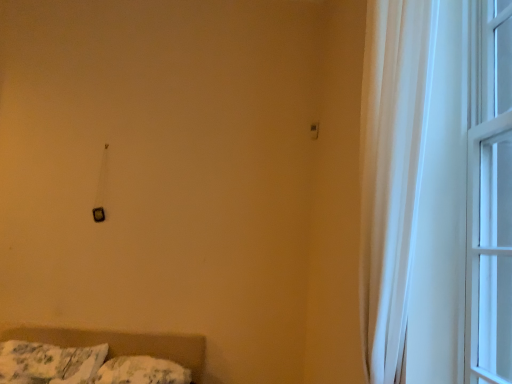
Identify the location of fluffy white pillow at lower left, placed as the first pillow when sorted from left to right. This screenshot has height=384, width=512. (49, 363).

This screenshot has height=384, width=512. What do you see at coordinates (142, 371) in the screenshot? I see `fluffy white pillow at lower left, placed as the first pillow when sorted from right to left` at bounding box center [142, 371].

Identify the location of fluffy white pillow at lower left, the 2th pillow from the left. (142, 371).

What do you see at coordinates (437, 192) in the screenshot?
I see `white sheer curtain at right, acting as the second window starting from the right` at bounding box center [437, 192].

The width and height of the screenshot is (512, 384). What are the coordinates of `fluffy white pillow at lower left, placed as the first pillow when sorted from left to right` in the screenshot? It's located at (49, 363).

Is matte black switch at upper center not inside white sheer curtain at right, which ranks as the first window in left-to-right order?

matte black switch at upper center is positioned outside white sheer curtain at right, which ranks as the first window in left-to-right order.

What's the angular difference between matte black switch at upper center and white sheer curtain at right, which ranks as the first window in left-to-right order,'s facing directions?

They differ by 89.5 degrees in their facing directions.

Which of these two, matte black switch at upper center or white sheer curtain at right, acting as the second window starting from the right, is bigger?

With larger size is white sheer curtain at right, acting as the second window starting from the right.

Considering the points (316, 126) and (450, 265), which point is in front, point (316, 126) or point (450, 265)?

The point (450, 265) is closer.

From a real-world perspective, between fluffy white pillow at lower left, placed as the first pillow when sorted from left to right, and fluffy white pillow at lower left, placed as the first pillow when sorted from right to left, who is vertically lower?

fluffy white pillow at lower left, placed as the first pillow when sorted from right to left, from a real-world perspective.

Looking at this image, considering the relative sizes of fluffy white pillow at lower left, which is the second pillow in right-to-left order, and fluffy white pillow at lower left, the 2th pillow from the left, in the image provided, is fluffy white pillow at lower left, which is the second pillow in right-to-left order, bigger than fluffy white pillow at lower left, the 2th pillow from the left,?

Yes, fluffy white pillow at lower left, which is the second pillow in right-to-left order, is bigger than fluffy white pillow at lower left, the 2th pillow from the left.

Considering the relative sizes of fluffy white pillow at lower left, placed as the first pillow when sorted from left to right, and fluffy white pillow at lower left, the 2th pillow from the left, in the image provided, is fluffy white pillow at lower left, placed as the first pillow when sorted from left to right, shorter than fluffy white pillow at lower left, the 2th pillow from the left,?

In fact, fluffy white pillow at lower left, placed as the first pillow when sorted from left to right, may be taller than fluffy white pillow at lower left, the 2th pillow from the left.

Is fluffy white pillow at lower left, which is the second pillow in right-to-left order, not inside fluffy white pillow at lower left, placed as the first pillow when sorted from right to left?

fluffy white pillow at lower left, which is the second pillow in right-to-left order, lies outside fluffy white pillow at lower left, placed as the first pillow when sorted from right to left,'s area.

Would you say fluffy white pillow at lower left, placed as the first pillow when sorted from left to right, is a long distance from white sheer curtain at right, acting as the second window starting from the right?

That's right, there is a large distance between fluffy white pillow at lower left, placed as the first pillow when sorted from left to right, and white sheer curtain at right, acting as the second window starting from the right.

Which is behind, point (17, 360) or point (482, 199)?

Positioned behind is point (17, 360).

Looking at this image, is fluffy white pillow at lower left, placed as the first pillow when sorted from left to right, positioned with its back to white sheer curtain at right, acting as the second window starting from the right?

fluffy white pillow at lower left, placed as the first pillow when sorted from left to right, does not have its back to white sheer curtain at right, acting as the second window starting from the right.

Can you confirm if white glass window at right, the first window in the right-to-left sequence, is smaller than fluffy white pillow at lower left, placed as the first pillow when sorted from right to left?

Correct, white glass window at right, the first window in the right-to-left sequence, occupies less space than fluffy white pillow at lower left, placed as the first pillow when sorted from right to left.

From a real-world perspective, relative to fluffy white pillow at lower left, placed as the first pillow when sorted from right to left, is white glass window at right, the first window in the right-to-left sequence, vertically above or below?

Clearly, from a real-world perspective, white glass window at right, the first window in the right-to-left sequence, is above fluffy white pillow at lower left, placed as the first pillow when sorted from right to left.

Could you measure the distance between white glass window at right, which is the second window from left to right, and fluffy white pillow at lower left, placed as the first pillow when sorted from right to left?

They are 2.11 meters apart.

Between white glass window at right, which is the second window from left to right, and fluffy white pillow at lower left, placed as the first pillow when sorted from right to left, which one has more height?

white glass window at right, which is the second window from left to right, is taller.

In the scene shown: Does white glass window at right, the first window in the right-to-left sequence, appear on the right side of fluffy white pillow at lower left, which is the second pillow in right-to-left order?

Correct, you'll find white glass window at right, the first window in the right-to-left sequence, to the right of fluffy white pillow at lower left, which is the second pillow in right-to-left order.

Is white glass window at right, the first window in the right-to-left sequence, positioned beyond the bounds of fluffy white pillow at lower left, placed as the first pillow when sorted from left to right?

Absolutely, white glass window at right, the first window in the right-to-left sequence, is external to fluffy white pillow at lower left, placed as the first pillow when sorted from left to right.

How much distance is there between white glass window at right, the first window in the right-to-left sequence, and fluffy white pillow at lower left, placed as the first pillow when sorted from left to right?

white glass window at right, the first window in the right-to-left sequence, is 8.21 feet away from fluffy white pillow at lower left, placed as the first pillow when sorted from left to right.

Considering the sizes of objects white glass window at right, the first window in the right-to-left sequence, and fluffy white pillow at lower left, which is the second pillow in right-to-left order, in the image provided, who is taller, white glass window at right, the first window in the right-to-left sequence, or fluffy white pillow at lower left, which is the second pillow in right-to-left order,?

With more height is white glass window at right, the first window in the right-to-left sequence.

Is white sheer curtain at right, which ranks as the first window in left-to-right order, looking in the opposite direction of matte black switch at upper center?

That's not correct — white sheer curtain at right, which ranks as the first window in left-to-right order, is not looking away from matte black switch at upper center.

Which point is more forward, (375, 240) or (316, 131)?

The point (375, 240) is more forward.

Is there a large distance between white sheer curtain at right, acting as the second window starting from the right, and matte black switch at upper center?

Yes, white sheer curtain at right, acting as the second window starting from the right, and matte black switch at upper center are located far from each other.

Which object is thinner, white sheer curtain at right, acting as the second window starting from the right, or matte black switch at upper center?

Thinner between the two is matte black switch at upper center.

Is matte black switch at upper center not inside fluffy white pillow at lower left, the 2th pillow from the left?

Indeed, matte black switch at upper center is completely outside fluffy white pillow at lower left, the 2th pillow from the left.

Is there a large distance between matte black switch at upper center and fluffy white pillow at lower left, the 2th pillow from the left?

Yes, matte black switch at upper center and fluffy white pillow at lower left, the 2th pillow from the left, are located far from each other.

From a real-world perspective, who is located lower, matte black switch at upper center or fluffy white pillow at lower left, placed as the first pillow when sorted from right to left?

From a 3D spatial view, fluffy white pillow at lower left, placed as the first pillow when sorted from right to left, is below.

From the image's perspective, is matte black switch at upper center located above or below fluffy white pillow at lower left, placed as the first pillow when sorted from right to left?

Clearly, from the image's perspective, matte black switch at upper center is above fluffy white pillow at lower left, placed as the first pillow when sorted from right to left.

In order to click on light switch positioned vertically above the white sheer curtain at right, acting as the second window starting from the right (from a real-world perspective) in this screenshot , I will do `click(314, 130)`.

At what (x,y) coordinates should I click in order to perform the action: click on pillow on the left of fluffy white pillow at lower left, the 2th pillow from the left. Please return your answer as a coordinate pair (x, y). The height and width of the screenshot is (384, 512). Looking at the image, I should click on (49, 363).

Considering their positions, is fluffy white pillow at lower left, placed as the first pillow when sorted from left to right, positioned closer to matte black switch at upper center than white sheer curtain at right, acting as the second window starting from the right?

The object closer to matte black switch at upper center is white sheer curtain at right, acting as the second window starting from the right.

Based on their spatial positions, is white sheer curtain at right, acting as the second window starting from the right, or fluffy white pillow at lower left, placed as the first pillow when sorted from left to right, further from fluffy white pillow at lower left, the 2th pillow from the left?

Based on the image, white sheer curtain at right, acting as the second window starting from the right, appears to be further to fluffy white pillow at lower left, the 2th pillow from the left.

Based on their spatial positions, is white glass window at right, which is the second window from left to right, or fluffy white pillow at lower left, the 2th pillow from the left, further from matte black switch at upper center?

Among the two, fluffy white pillow at lower left, the 2th pillow from the left, is located further to matte black switch at upper center.

Which object lies further to the anchor point white glass window at right, the first window in the right-to-left sequence, matte black switch at upper center or fluffy white pillow at lower left, placed as the first pillow when sorted from left to right?

fluffy white pillow at lower left, placed as the first pillow when sorted from left to right, is positioned further to the anchor white glass window at right, the first window in the right-to-left sequence.

Estimate the real-world distances between objects in this image. Which object is closer to white sheer curtain at right, which ranks as the first window in left-to-right order, matte black switch at upper center or fluffy white pillow at lower left, placed as the first pillow when sorted from right to left?

Among the two, matte black switch at upper center is located nearer to white sheer curtain at right, which ranks as the first window in left-to-right order.

In the scene shown: Looking at the image, which one is located further to fluffy white pillow at lower left, placed as the first pillow when sorted from left to right, white glass window at right, which is the second window from left to right, or fluffy white pillow at lower left, the 2th pillow from the left?

white glass window at right, which is the second window from left to right, lies further to fluffy white pillow at lower left, placed as the first pillow when sorted from left to right, than the other object.

When comparing their distances from white glass window at right, which is the second window from left to right, does fluffy white pillow at lower left, the 2th pillow from the left, or fluffy white pillow at lower left, placed as the first pillow when sorted from left to right, seem closer?

Among the two, fluffy white pillow at lower left, the 2th pillow from the left, is located nearer to white glass window at right, which is the second window from left to right.

Estimate the real-world distances between objects in this image. Which object is further from fluffy white pillow at lower left, placed as the first pillow when sorted from left to right, fluffy white pillow at lower left, placed as the first pillow when sorted from right to left, or white glass window at right, which is the second window from left to right?

white glass window at right, which is the second window from left to right, lies further to fluffy white pillow at lower left, placed as the first pillow when sorted from left to right, than the other object.

Find the location of a particular element. light switch between fluffy white pillow at lower left, which is the second pillow in right-to-left order, and white glass window at right, which is the second window from left to right, in the horizontal direction is located at coordinates tap(314, 130).

You are a GUI agent. You are given a task and a screenshot of the screen. Output one action in this format:
    pyautogui.click(x=<x>, y=<y>)
    Task: Click on the window between white sheer curtain at right, acting as the second window starting from the right, and fluffy white pillow at lower left, the 2th pillow from the left, in the front-back direction
    Image resolution: width=512 pixels, height=384 pixels.
    Given the screenshot: What is the action you would take?
    pyautogui.click(x=490, y=197)

Where is `pillow between white sheer curtain at right, acting as the second window starting from the right, and fluffy white pillow at lower left, placed as the first pillow when sorted from right to left, in the front-back direction`? This screenshot has width=512, height=384. pillow between white sheer curtain at right, acting as the second window starting from the right, and fluffy white pillow at lower left, placed as the first pillow when sorted from right to left, in the front-back direction is located at coordinates (49, 363).

Image resolution: width=512 pixels, height=384 pixels. Identify the location of pillow between fluffy white pillow at lower left, placed as the first pillow when sorted from left to right, and white glass window at right, the first window in the right-to-left sequence, in the horizontal direction. (142, 371).